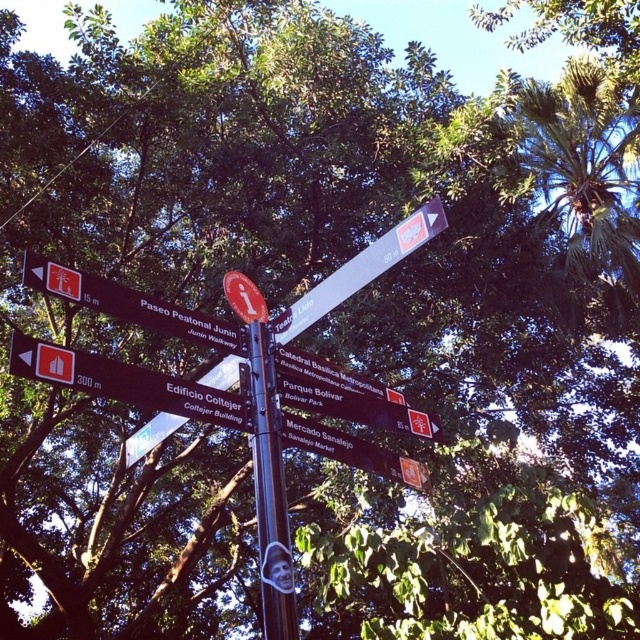
You are a tourist holding a map and looking at the street signpost. You need to find the direction to the Catedral Basilica Metropolitana. Both the white plastic sign at upper center and the matte red sign at center have information about it. Which sign should you look at first?

The white plastic sign at upper center is located above the matte red sign at center, so you should look at the white plastic sign at upper center first as it is positioned higher up on the signpost.

You are a tourist holding a map and standing in front of the signpost. You need to choose between the brown wooden sign at center and the matte red sign at center for directions. Which sign should you look at first based on their sizes?

The brown wooden sign at center is taller than the matte red sign at center, so you should look at the brown wooden sign at center first as it is larger and likely contains more detailed information.

You are a tourist holding a map and looking at the street signpost. You need to determine which direction to go for both the white plastic sign at upper center and the matte red sign at center. Since you can only choose one direction, which sign should you prioritize based on their sizes?

The white plastic sign at upper center is larger in size than the matte red sign at center, so you should prioritize following the direction indicated by the white plastic sign at upper center because larger signs often indicate more prominent or closer destinations.